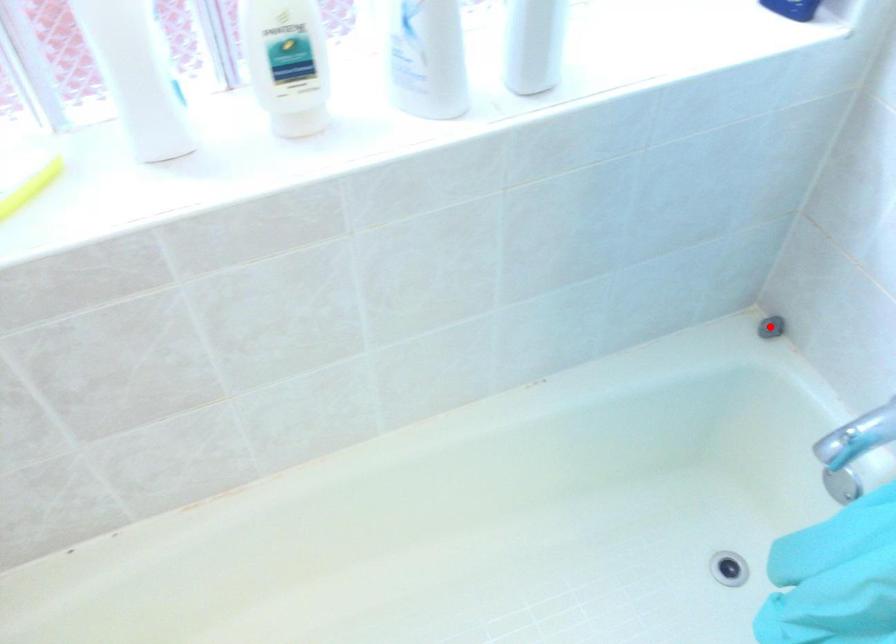
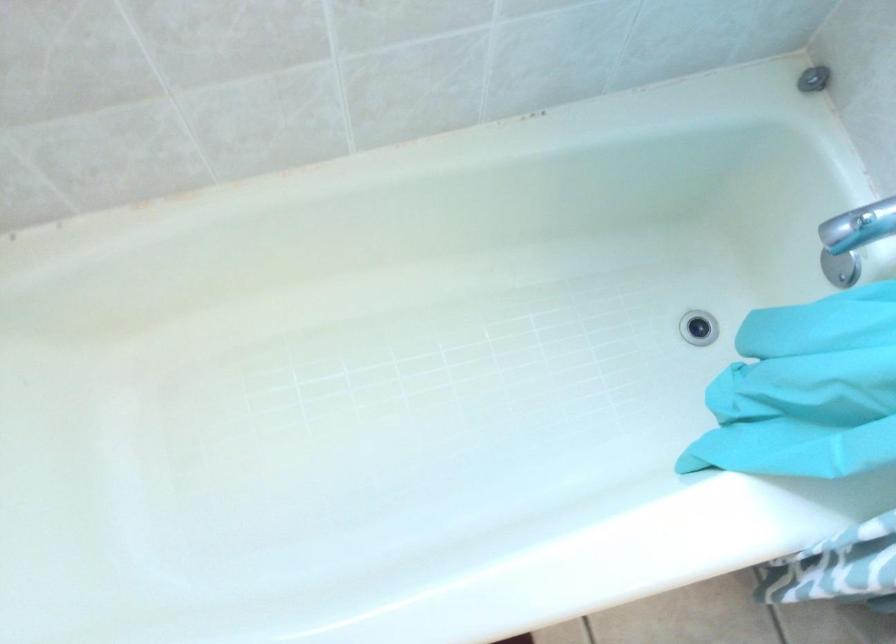
Find the pixel in the second image that matches the highlighted location in the first image.

(814, 79)